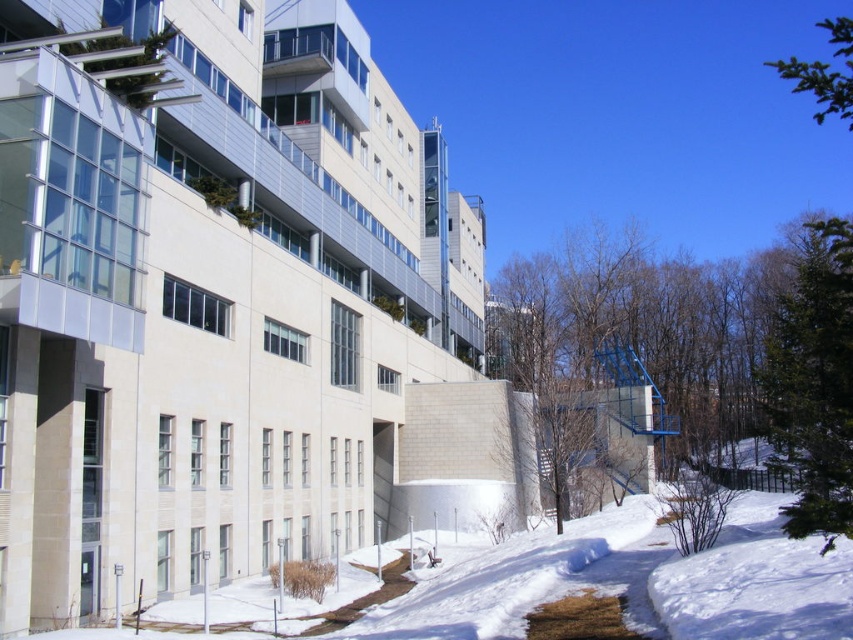
Between green leafy tree at right and green textured pine tree at upper right, which one appears on the right side from the viewer's perspective?

green textured pine tree at upper right

Is green leafy tree at right thinner than green textured pine tree at upper right?

Indeed, green leafy tree at right has a lesser width compared to green textured pine tree at upper right.

Is point (601, 300) behind point (798, 70)?

Yes.

At what (x,y) coordinates should I click in order to perform the action: click on green leafy tree at right. Please return your answer as a coordinate pair (x, y). This screenshot has height=640, width=853. Looking at the image, I should click on (692, 362).

Is the position of green textured evergreen tree at right more distant than that of green textured pine tree at upper right?

No, green textured evergreen tree at right is in front of green textured pine tree at upper right.

Who is more forward, (808, 378) or (840, 67)?

Point (808, 378) is more forward.

At what (x,y) coordinates should I click in order to perform the action: click on green textured evergreen tree at right. Please return your answer as a coordinate pair (x, y). Image resolution: width=853 pixels, height=640 pixels. Looking at the image, I should click on (814, 381).

The height and width of the screenshot is (640, 853). Identify the location of green leafy tree at right. (692, 362).

Where is `green leafy tree at right`? This screenshot has height=640, width=853. green leafy tree at right is located at coordinates (692, 362).